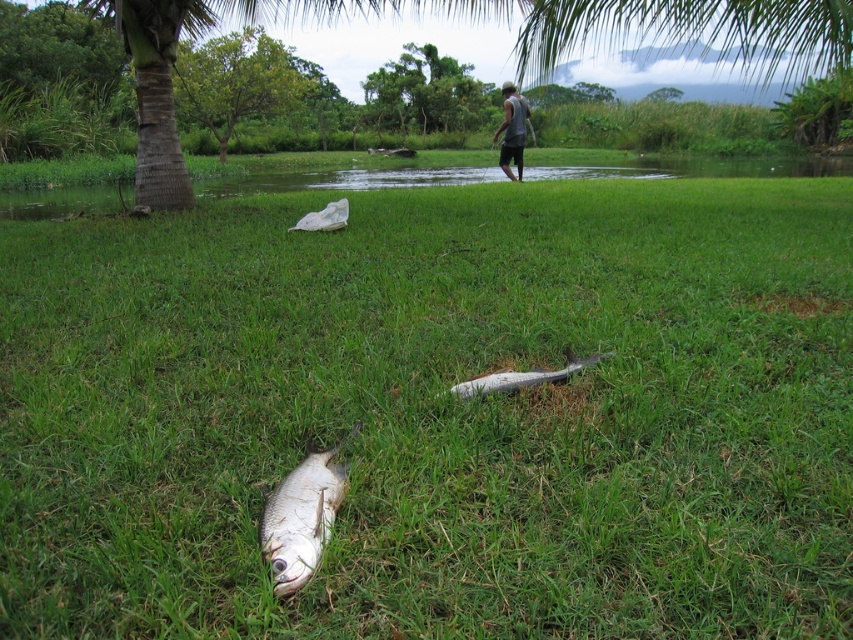
Question: Which point is closer to the camera?

Choices:
 (A) (293, 563)
 (B) (323, 218)
 (C) (625, 465)
 (D) (521, 116)

Answer: (A)

Question: From the image, what is the correct spatial relationship of shiny silver fish at lower center in relation to silver shiny fish at center?

Choices:
 (A) left
 (B) right

Answer: (A)

Question: Which of the following is the farthest from the observer?

Choices:
 (A) white plastic bag at center
 (B) shiny silver fish at lower center

Answer: (A)

Question: Is the position of gray fabric shirt at upper center less distant than that of white plastic bag at center?

Choices:
 (A) no
 (B) yes

Answer: (A)

Question: Is green grass at center below shiny silver fish at lower center?

Choices:
 (A) no
 (B) yes

Answer: (A)

Question: Which of the following is the closest to the observer?

Choices:
 (A) silver shiny fish at center
 (B) shiny silver fish at lower center
 (C) white plastic bag at center

Answer: (B)